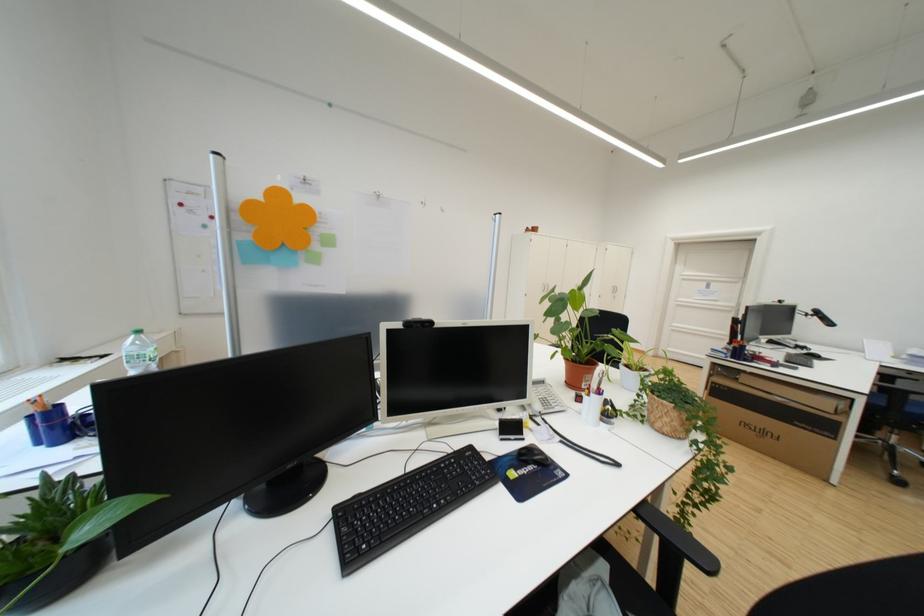
This screenshot has height=616, width=924. Identify the location of blue pen holder. coord(56,424).